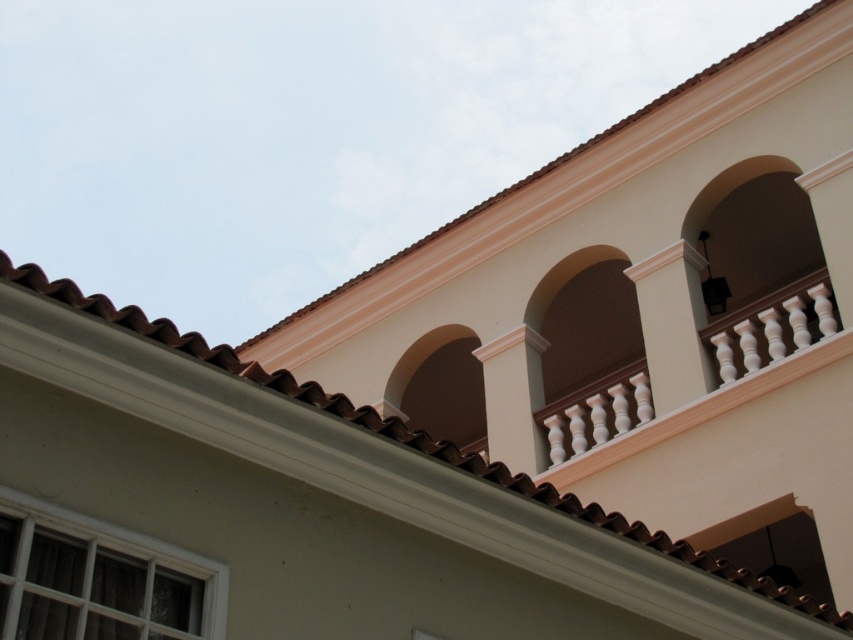
Is white smooth pillar at upper center wider than white glossy column at upper center?

Correct, the width of white smooth pillar at upper center exceeds that of white glossy column at upper center.

Is white smooth pillar at upper center smaller than white glossy column at upper center?

Incorrect, white smooth pillar at upper center is not smaller in size than white glossy column at upper center.

Between point (692, 374) and point (502, 349), which one is positioned in front?

Point (692, 374) is in front.

At what (x,y) coordinates should I click in order to perform the action: click on white smooth pillar at upper center. Please return your answer as a coordinate pair (x, y). The width and height of the screenshot is (853, 640). Looking at the image, I should click on (672, 324).